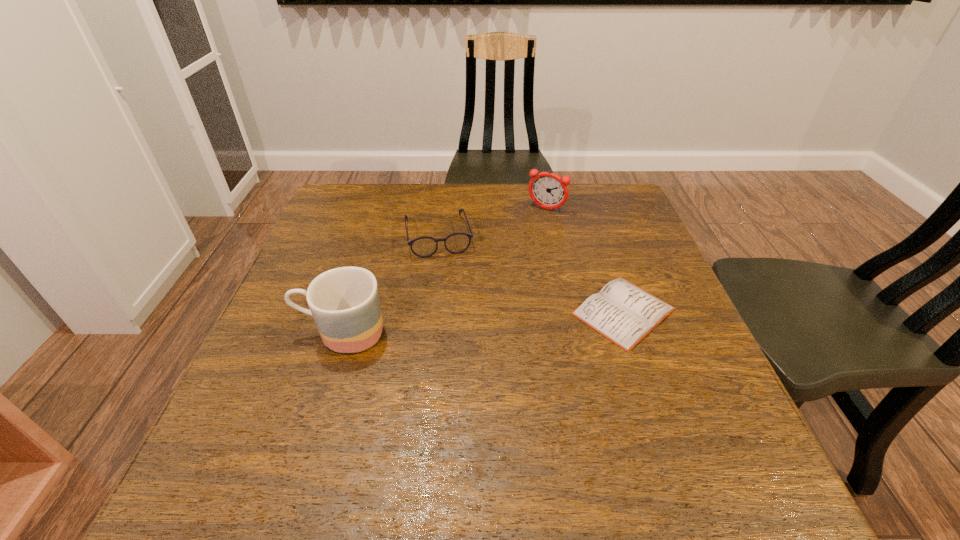
Find the location of a particular element. The image size is (960, 540). vacant area that lies between the shortest object and the mug is located at coordinates (483, 322).

Identify the location of empty space between the spectacles and the mug. (390, 284).

Where is `empty location between the spectacles and the diary`? The height and width of the screenshot is (540, 960). empty location between the spectacles and the diary is located at coordinates (531, 273).

Select which object is the third closest to the spectacles. Please provide its 2D coordinates. Your answer should be formatted as a tuple, i.e. [(x, y)], where the tuple contains the x and y coordinates of a point satisfying the conditions above.

[(622, 312)]

Choose which object is the second nearest neighbor to the shortest object. Please provide its 2D coordinates. Your answer should be formatted as a tuple, i.e. [(x, y)], where the tuple contains the x and y coordinates of a point satisfying the conditions above.

[(548, 190)]